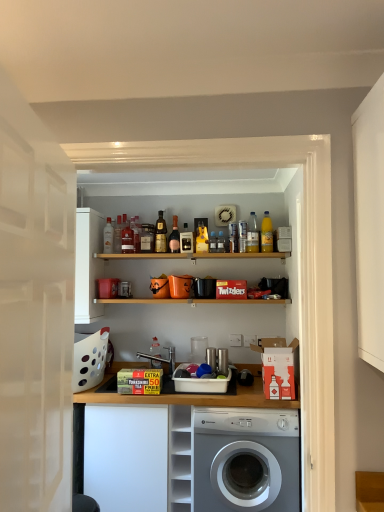
Question: Visually, is white glossy door at left positioned to the left or to the right of white plastic cabinet at lower center?

Choices:
 (A) left
 (B) right

Answer: (A)

Question: Considering the positions of white glossy door at left and white plastic cabinet at lower center in the image, is white glossy door at left bigger or smaller than white plastic cabinet at lower center?

Choices:
 (A) small
 (B) big

Answer: (A)

Question: Which of these objects is positioned closest to the white plastic cabinet at lower center?

Choices:
 (A) translucent glass bottle at center, positioned as the 8th bottle in right-to-left order
 (B) white glossy door at left
 (C) shiny gold bottle at center, which is the 6th bottle in right-to-left order
 (D) matte glass bottle at upper center, positioned as the 1th bottle in left-to-right order
 (E) matte glass bottle at upper center, which ranks as the 3th bottle in left-to-right order

Answer: (C)

Question: Which object is positioned farthest from the pink glass bottle at upper center, which appears as the 7th bottle when viewed from the left?

Choices:
 (A) white plastic cabinet at lower center
 (B) silver metallic washing machine at center
 (C) yellow glass bottle at upper center, the 1th bottle in the right-to-left sequence
 (D) white matte cabinet at lower left
 (E) matte plastic bottle at upper center, marked as the 2th bottle in a left-to-right arrangement

Answer: (B)